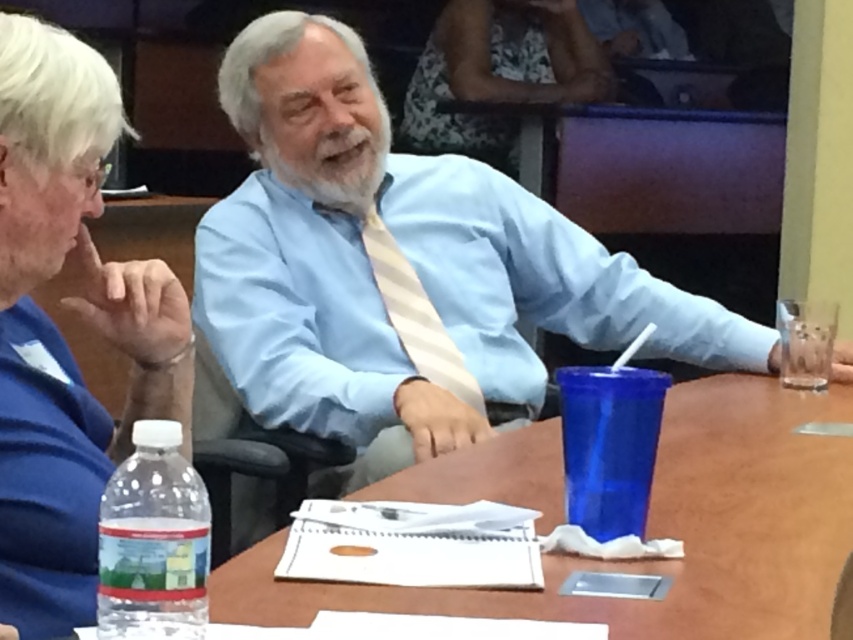
You are a photographer taking a portrait of the light blue shirt at center and the wooden table at center. Which object is taller in the image?

The light blue shirt at center is taller than the wooden table at center according to the description.

You are organizing a photo shoot and need to ensure that the light blue shirt at center and the blue fabric shirt at upper left are visible in the frame. Based on their positions and sizes, which shirt should you focus on to capture both in the frame without cropping either?

The light blue shirt at center might be wider than blue fabric shirt at upper left, so focusing on the light blue shirt at center would ensure both shirts are visible as it occupies more space in the frame.

You are a tailor measuring the wooden table at center and the light beige striped tie at center for a custom order. Which item is shorter in height?

The wooden table at center has a lesser height compared to the light beige striped tie at center, so the wooden table at center is shorter in height.